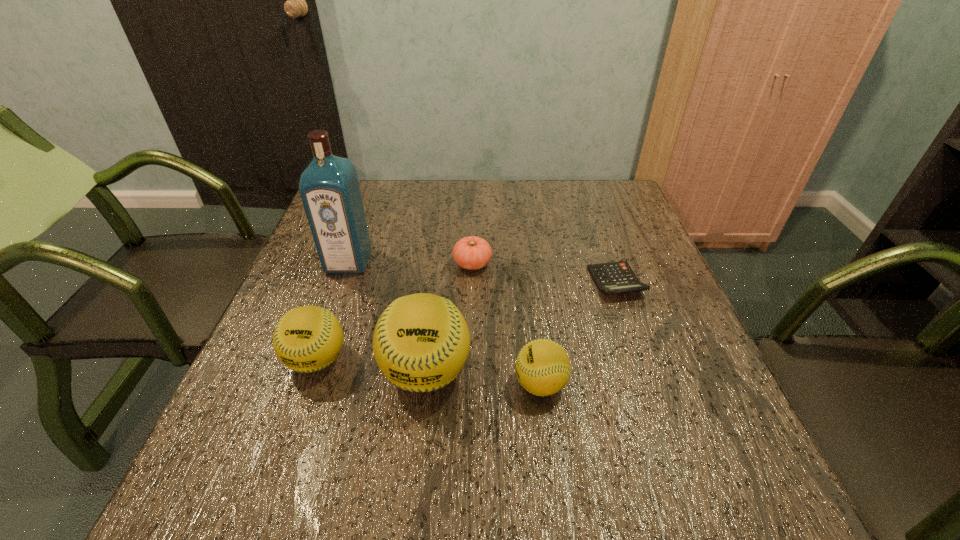
Find the location of `vacant region located 0.060m on the logo side of the fourth shortest object`. vacant region located 0.060m on the logo side of the fourth shortest object is located at coordinates (298, 414).

Locate an element on the screen. The image size is (960, 540). vacant point located 0.200m on the logo side of the rightmost softball is located at coordinates (408, 384).

This screenshot has height=540, width=960. Identify the location of free space located on the logo side of the rightmost softball. (302, 384).

You are a GUI agent. You are given a task and a screenshot of the screen. Output one action in this format:
    pyautogui.click(x=<x>, y=<y>)
    Task: Click on the vacant area situated on the logo side of the rightmost softball
    The image size is (960, 540).
    Given the screenshot: What is the action you would take?
    pyautogui.click(x=435, y=384)

The width and height of the screenshot is (960, 540). Identify the location of vacant space located 0.160m on the flat label side of the tallest object. (326, 324).

The width and height of the screenshot is (960, 540). I want to click on vacant space located 0.080m on the back of the calculator, so click(603, 245).

Locate an element on the screen. Image resolution: width=960 pixels, height=540 pixels. free space located 0.110m on the right of the tomato is located at coordinates (536, 264).

At what (x,y) coordinates should I click in order to perform the action: click on softball positioned at the left edge. Please return your answer as a coordinate pair (x, y). Looking at the image, I should click on (309, 338).

Image resolution: width=960 pixels, height=540 pixels. What are the coordinates of `liquor present at the left edge` in the screenshot? It's located at tap(329, 187).

I want to click on object that is at the right edge, so coord(616,277).